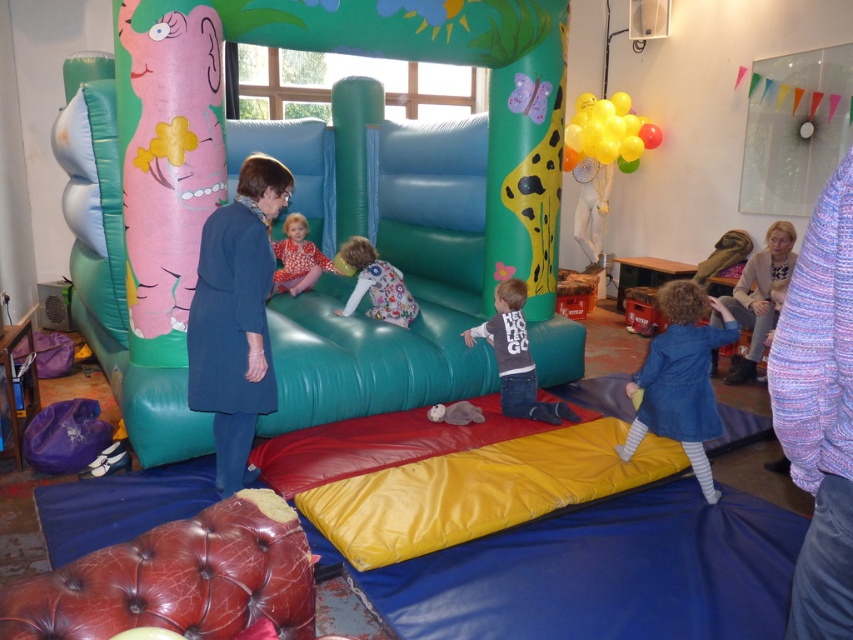
Between dark gray denim jeans at center and matte pink dress at center, which one is positioned higher?

matte pink dress at center is above.

Which is in front, point (511, 326) or point (302, 284)?

Positioned in front is point (511, 326).

Who is more distant from viewer, (502, 289) or (299, 243)?

Point (299, 243)

Where is `dark gray denim jeans at center`? This screenshot has width=853, height=640. dark gray denim jeans at center is located at coordinates (515, 356).

Can you confirm if dark gray denim jeans at center is wider than floral dress at center?

Yes.

Which is above, dark gray denim jeans at center or floral dress at center?

floral dress at center is higher up.

Is point (502, 381) behind point (361, 243)?

No.

At what (x,y) coordinates should I click in order to perform the action: click on dark gray denim jeans at center. Please return your answer as a coordinate pair (x, y). The image size is (853, 640). Looking at the image, I should click on (515, 356).

Is knitted sweater at right above floral dress at center?

No.

Is point (770, 269) farther from viewer compared to point (349, 301)?

Yes, it is behind point (349, 301).

The width and height of the screenshot is (853, 640). I want to click on knitted sweater at right, so [x=759, y=296].